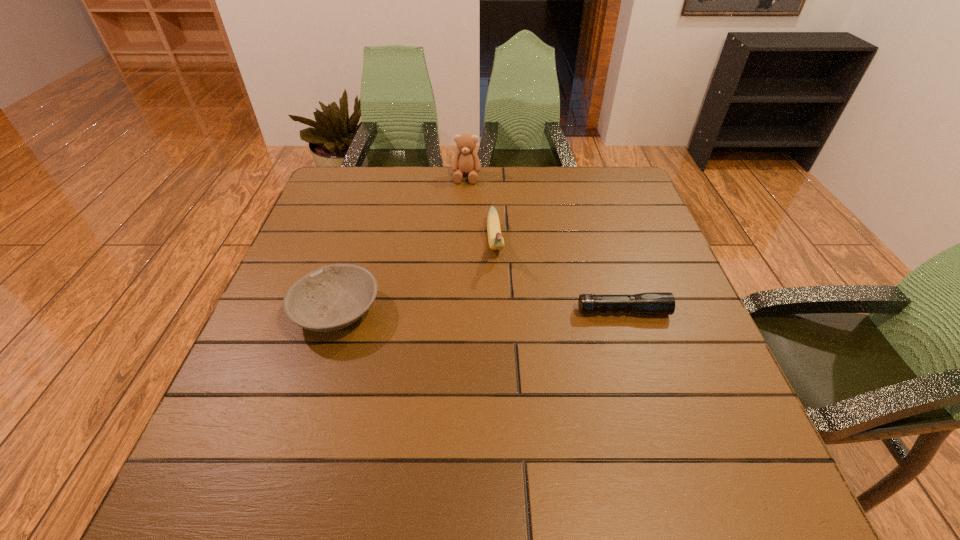
I want to click on the second shortest object, so click(x=332, y=297).

Identify the location of bowl. (332, 297).

This screenshot has height=540, width=960. In order to click on flashlight in this screenshot , I will do `click(655, 303)`.

Where is `the shortest object`? The image size is (960, 540). the shortest object is located at coordinates (655, 303).

Locate an element on the screen. The image size is (960, 540). teddy bear is located at coordinates (466, 161).

I want to click on the second object from left to right, so [x=466, y=161].

Where is `the third nearest object`? the third nearest object is located at coordinates (496, 242).

At what (x,y) coordinates should I click in order to perform the action: click on banana. Please return your answer as a coordinate pair (x, y). Looking at the image, I should click on (496, 242).

Where is `free location located on the right of the leftmost object`? The image size is (960, 540). free location located on the right of the leftmost object is located at coordinates (431, 312).

In order to click on free location located 0.190m on the face of the farthest object in this screenshot , I will do `click(459, 222)`.